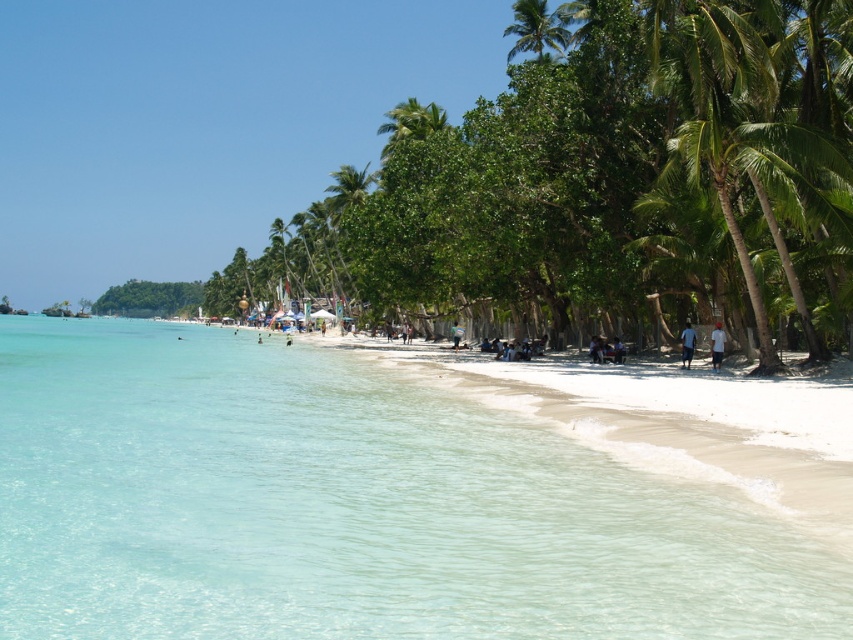
Between blue fabric shirt at lower right and white fabric umbrella at center, which one has less height?

blue fabric shirt at lower right

Does point (683, 346) come behind point (462, 332)?

No.

What are the coordinates of `blue fabric shirt at lower right` in the screenshot? It's located at (688, 344).

Between clear water at beach right and green leafy palm tree at upper right, which one is positioned higher?

green leafy palm tree at upper right is above.

This screenshot has height=640, width=853. What do you see at coordinates (350, 506) in the screenshot?
I see `clear water at beach right` at bounding box center [350, 506].

At what (x,y) coordinates should I click in order to perform the action: click on clear water at beach right. Please return your answer as a coordinate pair (x, y). Looking at the image, I should click on (350, 506).

Is green leafy palm tree at upper right taller than white matte shirt at lower right?

Yes, green leafy palm tree at upper right is taller than white matte shirt at lower right.

Is point (537, 8) positioned in front of point (722, 349)?

No, (537, 8) is further to viewer.

You are a GUI agent. You are given a task and a screenshot of the screen. Output one action in this format:
    pyautogui.click(x=<x>, y=<y>)
    Task: Click on the green leafy palm tree at upper right
    This screenshot has height=640, width=853.
    Given the screenshot: What is the action you would take?
    pyautogui.click(x=535, y=28)